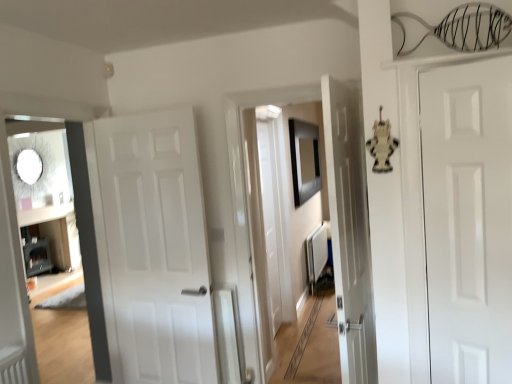
Question: Is white matte radiator at center thinner than black matte picture frame at center?

Choices:
 (A) no
 (B) yes

Answer: (A)

Question: Can you confirm if white matte radiator at center is smaller than black matte picture frame at center?

Choices:
 (A) yes
 (B) no

Answer: (A)

Question: Is white matte radiator at center taller than black matte picture frame at center?

Choices:
 (A) no
 (B) yes

Answer: (A)

Question: Is white matte radiator at center at the left side of black matte picture frame at center?

Choices:
 (A) no
 (B) yes

Answer: (A)

Question: From the image's perspective, does white matte radiator at center appear higher than black matte picture frame at center?

Choices:
 (A) yes
 (B) no

Answer: (B)

Question: Is point click(x=452, y=193) positioned closer to the camera than point click(x=100, y=153)?

Choices:
 (A) farther
 (B) closer

Answer: (B)

Question: Do you think white glossy door at right, which is counted as the first door, starting from the right, is within white matte door at center, positioned as the first door in left-to-right order, or outside of it?

Choices:
 (A) inside
 (B) outside

Answer: (B)

Question: From a real-world perspective, is white glossy door at right, acting as the 2th door starting from the back, positioned above or below white matte door at center, positioned as the first door in left-to-right order?

Choices:
 (A) below
 (B) above

Answer: (B)

Question: From the image's perspective, is white glossy door at right, which is counted as the first door, starting from the right, positioned above or below white matte door at center, which is the second door in right-to-left order?

Choices:
 (A) above
 (B) below

Answer: (A)

Question: Does point (181, 172) appear closer or farther from the camera than point (309, 264)?

Choices:
 (A) farther
 (B) closer

Answer: (B)

Question: From the image's perspective, is white matte door at center, which is the second door in right-to-left order, positioned above or below white matte radiator at center?

Choices:
 (A) above
 (B) below

Answer: (A)

Question: Is white matte door at center, placed as the first door when sorted from back to front, bigger or smaller than white matte radiator at center?

Choices:
 (A) big
 (B) small

Answer: (A)

Question: Would you say white matte door at center, placed as the first door when sorted from back to front, is to the left or to the right of white matte radiator at center in the picture?

Choices:
 (A) left
 (B) right

Answer: (A)

Question: Is matte white door at left wider or thinner than black matte picture frame at center?

Choices:
 (A) thin
 (B) wide

Answer: (B)

Question: Considering the positions of matte white door at left and black matte picture frame at center in the image, is matte white door at left taller or shorter than black matte picture frame at center?

Choices:
 (A) tall
 (B) short

Answer: (A)